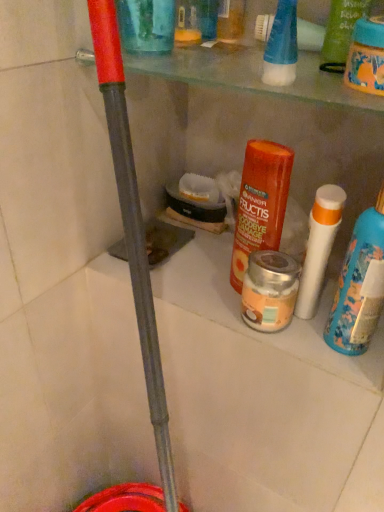
This screenshot has width=384, height=512. What do you see at coordinates (359, 285) in the screenshot? I see `white matte bottle at right` at bounding box center [359, 285].

I want to click on green matte shampoo at upper right, positioned as the first product in right-to-left order, so click(340, 33).

The height and width of the screenshot is (512, 384). Describe the element at coordinates (319, 246) in the screenshot. I see `white matte tube at right` at that location.

This screenshot has height=512, width=384. What are the coordinates of `white matte bottle at right` in the screenshot? It's located at (359, 285).

From a real-world perspective, is white matte bottle at right above or below silver metallic jar at center, the 2th product in the right-to-left sequence?

From a real-world perspective, white matte bottle at right is physically above silver metallic jar at center, the 2th product in the right-to-left sequence.

Does white matte bottle at right turn towards silver metallic jar at center, which is the third product from left to right?

No.

Does white matte bottle at right have a lesser width compared to silver metallic jar at center, the 2th product in the right-to-left sequence?

Correct, the width of white matte bottle at right is less than that of silver metallic jar at center, the 2th product in the right-to-left sequence.

Looking at this image, which of these two, white matte bottle at right or silver metallic jar at center, which is the third product from left to right, is smaller?

silver metallic jar at center, which is the third product from left to right.

Is silver metallic jar at center, the 2th product in the right-to-left sequence, facing away from green matte shampoo at upper right, positioned as the first product in right-to-left order?

silver metallic jar at center, the 2th product in the right-to-left sequence, is not turned away from green matte shampoo at upper right, positioned as the first product in right-to-left order.

From a real-world perspective, who is located lower, silver metallic jar at center, the 2th product in the right-to-left sequence, or green matte shampoo at upper right, the 4th product in the left-to-right sequence?

silver metallic jar at center, the 2th product in the right-to-left sequence, from a real-world perspective.

Would you say silver metallic jar at center, which is the third product from left to right, is inside or outside green matte shampoo at upper right, positioned as the first product in right-to-left order?

silver metallic jar at center, which is the third product from left to right, lies outside green matte shampoo at upper right, positioned as the first product in right-to-left order.

From the picture: From a real-world perspective, is green matte shampoo at upper right, positioned as the first product in right-to-left order, positioned over orange matte haircare product at center, which appears as the second product when viewed from the left, based on gravity?

Yes.

Does point (329, 48) appear closer or farther from the camera than point (278, 144)?

Point (329, 48) is closer to the camera than point (278, 144).

Considering the positions of objects green matte shampoo at upper right, the 4th product in the left-to-right sequence, and orange matte haircare product at center, which is counted as the 3th product, starting from the right, in the image provided, who is more to the left, green matte shampoo at upper right, the 4th product in the left-to-right sequence, or orange matte haircare product at center, which is counted as the 3th product, starting from the right,?

Positioned to the left is orange matte haircare product at center, which is counted as the 3th product, starting from the right.

Based on the photo, considering their positions, is green matte shampoo at upper right, positioned as the first product in right-to-left order, located in front of or behind orange matte haircare product at center, which appears as the second product when viewed from the left?

green matte shampoo at upper right, positioned as the first product in right-to-left order, is positioned closer to the viewer than orange matte haircare product at center, which appears as the second product when viewed from the left.

Is transparent plastic cup at upper center, the 1th product viewed from the left, wider than orange matte haircare product at center, which appears as the second product when viewed from the left?

No.

Is transparent plastic cup at upper center, the 1th product viewed from the left, facing away from orange matte haircare product at center, which appears as the second product when viewed from the left?

No, orange matte haircare product at center, which appears as the second product when viewed from the left, is not at the back of transparent plastic cup at upper center, the 1th product viewed from the left.

Considering the sizes of objects transparent plastic cup at upper center, placed as the fourth product when sorted from right to left, and orange matte haircare product at center, which is counted as the 3th product, starting from the right, in the image provided, who is taller, transparent plastic cup at upper center, placed as the fourth product when sorted from right to left, or orange matte haircare product at center, which is counted as the 3th product, starting from the right,?

transparent plastic cup at upper center, placed as the fourth product when sorted from right to left, is taller.

Is the position of silver metallic jar at center, which is the third product from left to right, less distant than that of transparent plastic cup at upper center, the 1th product viewed from the left?

No, silver metallic jar at center, which is the third product from left to right, is behind transparent plastic cup at upper center, the 1th product viewed from the left.

Is silver metallic jar at center, which is the third product from left to right, to the left of transparent plastic cup at upper center, placed as the fourth product when sorted from right to left, from the viewer's perspective?

No, silver metallic jar at center, which is the third product from left to right, is not to the left of transparent plastic cup at upper center, placed as the fourth product when sorted from right to left.

Is silver metallic jar at center, the 2th product in the right-to-left sequence, oriented away from transparent plastic cup at upper center, placed as the fourth product when sorted from right to left?

No, silver metallic jar at center, the 2th product in the right-to-left sequence,'s orientation is not away from transparent plastic cup at upper center, placed as the fourth product when sorted from right to left.

Is white matte tube at right in front of or behind orange matte haircare product at center, which is counted as the 3th product, starting from the right, in the image?

In the image, white matte tube at right appears in front of orange matte haircare product at center, which is counted as the 3th product, starting from the right.

From a real-world perspective, which product is the 1st one above the white matte tube at right? Please provide its 2D coordinates.

[(260, 203)]

Considering the positions of point (303, 295) and point (258, 227), is point (303, 295) closer or farther from the camera than point (258, 227)?

Point (303, 295) appears to be closer to the viewer than point (258, 227).

Considering the relative positions of white matte tube at right and orange matte haircare product at center, which appears as the second product when viewed from the left, in the image provided, is white matte tube at right to the left of orange matte haircare product at center, which appears as the second product when viewed from the left, from the viewer's perspective?

Incorrect, white matte tube at right is not on the left side of orange matte haircare product at center, which appears as the second product when viewed from the left.

Is silver metallic jar at center, the 2th product in the right-to-left sequence, a part of orange matte haircare product at center, which appears as the second product when viewed from the left?

Definitely not — silver metallic jar at center, the 2th product in the right-to-left sequence, is not inside orange matte haircare product at center, which appears as the second product when viewed from the left.

Which object is closer to the camera taking this photo, orange matte haircare product at center, which is counted as the 3th product, starting from the right, or silver metallic jar at center, which is the third product from left to right?

orange matte haircare product at center, which is counted as the 3th product, starting from the right, is in front.

In the scene shown: From the image's perspective, would you say orange matte haircare product at center, which appears as the second product when viewed from the left, is shown under silver metallic jar at center, which is the third product from left to right?

Actually, orange matte haircare product at center, which appears as the second product when viewed from the left, appears above silver metallic jar at center, which is the third product from left to right, in the image.

Does orange matte haircare product at center, which is counted as the 3th product, starting from the right, have a lesser height compared to silver metallic jar at center, which is the third product from left to right?

No.

I want to click on the 3rd product behind the white matte bottle at right, starting your count from the anchor, so click(x=269, y=290).

Find the location of a particular element. The height and width of the screenshot is (512, 384). product on the right of silver metallic jar at center, which is the third product from left to right is located at coordinates (340, 33).

Based on their spatial positions, is transparent plastic cup at upper center, the 1th product viewed from the left, or orange matte haircare product at center, which appears as the second product when viewed from the left, closer to silver metallic jar at center, which is the third product from left to right?

orange matte haircare product at center, which appears as the second product when viewed from the left, is closer to silver metallic jar at center, which is the third product from left to right.

From the picture: Considering their positions, is white matte bottle at right positioned further to silver metallic jar at center, the 2th product in the right-to-left sequence, than green matte shampoo at upper right, positioned as the first product in right-to-left order?

Based on the image, green matte shampoo at upper right, positioned as the first product in right-to-left order, appears to be further to silver metallic jar at center, the 2th product in the right-to-left sequence.

Considering their positions, is white matte tube at right positioned closer to white matte bottle at right than green matte shampoo at upper right, positioned as the first product in right-to-left order?

The object closer to white matte bottle at right is white matte tube at right.

From the image, which object appears to be nearer to transparent plastic cup at upper center, placed as the fourth product when sorted from right to left, green matte shampoo at upper right, positioned as the first product in right-to-left order, or silver metallic jar at center, which is the third product from left to right?

green matte shampoo at upper right, positioned as the first product in right-to-left order, is closer to transparent plastic cup at upper center, placed as the fourth product when sorted from right to left.

Looking at the image, which one is located further to silver metallic jar at center, the 2th product in the right-to-left sequence, white matte tube at right or orange matte haircare product at center, which appears as the second product when viewed from the left?

The object further to silver metallic jar at center, the 2th product in the right-to-left sequence, is orange matte haircare product at center, which appears as the second product when viewed from the left.

Which object lies further to the anchor point green matte shampoo at upper right, the 4th product in the left-to-right sequence, white matte bottle at right or silver metallic jar at center, the 2th product in the right-to-left sequence?

silver metallic jar at center, the 2th product in the right-to-left sequence, lies further to green matte shampoo at upper right, the 4th product in the left-to-right sequence, than the other object.

Estimate the real-world distances between objects in this image. Which object is further from orange matte haircare product at center, which appears as the second product when viewed from the left, white matte tube at right or transparent plastic cup at upper center, placed as the fourth product when sorted from right to left?

transparent plastic cup at upper center, placed as the fourth product when sorted from right to left, lies further to orange matte haircare product at center, which appears as the second product when viewed from the left, than the other object.

Which object lies nearer to the anchor point white matte tube at right, white matte bottle at right or transparent plastic cup at upper center, placed as the fourth product when sorted from right to left?

white matte bottle at right lies closer to white matte tube at right than the other object.

Locate an element on the screen. The width and height of the screenshot is (384, 512). product between green matte shampoo at upper right, positioned as the first product in right-to-left order, and silver metallic jar at center, which is the third product from left to right, in the vertical direction is located at coordinates (260, 203).

Find the location of `product between transparent plastic cup at upper center, placed as the fourth product when sorted from right to left, and orange matte haircare product at center, which is counted as the 3th product, starting from the right, in the up-down direction`. product between transparent plastic cup at upper center, placed as the fourth product when sorted from right to left, and orange matte haircare product at center, which is counted as the 3th product, starting from the right, in the up-down direction is located at coordinates (340, 33).

The image size is (384, 512). Find the location of `cleaning product between silver metallic jar at center, the 2th product in the right-to-left sequence, and white matte bottle at right, in the horizontal direction`. cleaning product between silver metallic jar at center, the 2th product in the right-to-left sequence, and white matte bottle at right, in the horizontal direction is located at coordinates (319, 246).

At what (x,y) coordinates should I click in order to perform the action: click on cleaning product that lies between green matte shampoo at upper right, positioned as the first product in right-to-left order, and white matte bottle at right from top to bottom. Please return your answer as a coordinate pair (x, y). The height and width of the screenshot is (512, 384). Looking at the image, I should click on (319, 246).